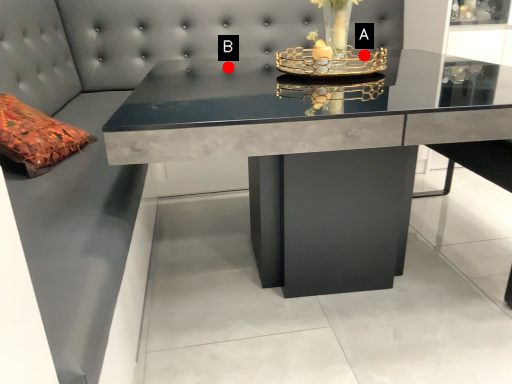
Question: Two points are circled on the image, labeled by A and B beside each circle. Which point appears closest to the camera in this image?

Choices:
 (A) A is closer
 (B) B is closer

Answer: (A)